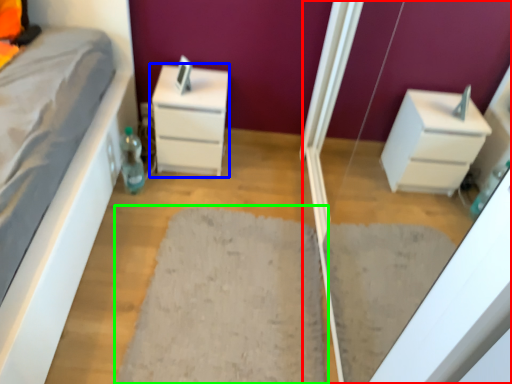
Question: Considering the real-world distances, which object is farthest from screen door (highlighted by a red box)? chest of drawers (highlighted by a blue box) or doormat (highlighted by a green box)?

Choices:
 (A) chest of drawers
 (B) doormat

Answer: (A)